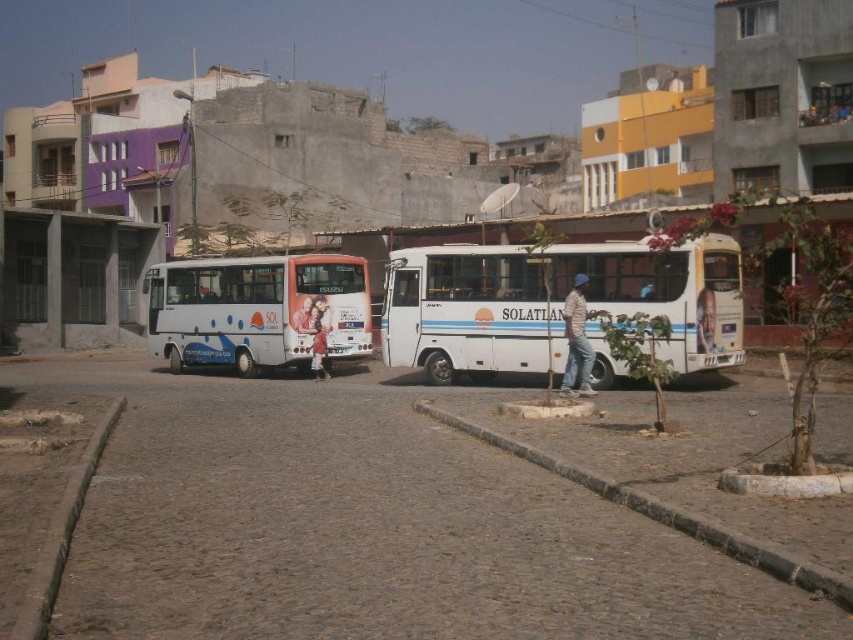
Question: Considering the relative positions of brown concrete curb at lower center and light pink fabric at center in the image provided, where is brown concrete curb at lower center located with respect to light pink fabric at center?

Choices:
 (A) above
 (B) below

Answer: (B)

Question: Considering the real-world distances, which object is closest to the white concrete bus stop at left?

Choices:
 (A) light pink fabric at center
 (B) blue denim jeans at center
 (C) brown concrete curb at lower center
 (D) smooth skin portrait at center

Answer: (A)

Question: Observing the image, what is the correct spatial positioning of white matte bus at center in reference to blue denim jeans at center?

Choices:
 (A) left
 (B) right

Answer: (B)

Question: Estimate the real-world distances between objects in this image. Which object is farther from the smooth skin portrait at center?

Choices:
 (A) brown concrete curb at lower center
 (B) white matte bus at center
 (C) white concrete bus stop at left

Answer: (C)

Question: Does white concrete bus stop at left have a lesser width compared to smooth skin portrait at center?

Choices:
 (A) no
 (B) yes

Answer: (A)

Question: Which of the following is the closest to the observer?

Choices:
 (A) white concrete bus stop at left
 (B) white glossy bus at left
 (C) brown concrete curb at lower left

Answer: (C)